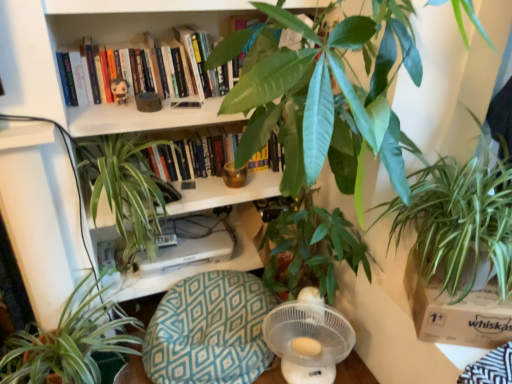
Question: Does white cardboard box at lower right have a larger size compared to plush toy at upper center?

Choices:
 (A) no
 (B) yes

Answer: (B)

Question: Is white cardboard box at lower right further to camera compared to plush toy at upper center?

Choices:
 (A) no
 (B) yes

Answer: (A)

Question: Is white cardboard box at lower right facing towards plush toy at upper center?

Choices:
 (A) no
 (B) yes

Answer: (A)

Question: Does white cardboard box at lower right have a lesser height compared to plush toy at upper center?

Choices:
 (A) no
 (B) yes

Answer: (A)

Question: Is white cardboard box at lower right oriented away from plush toy at upper center?

Choices:
 (A) no
 (B) yes

Answer: (A)

Question: From the image's perspective, would you say white cardboard box at lower right is shown under plush toy at upper center?

Choices:
 (A) no
 (B) yes

Answer: (B)

Question: Would you consider hardcover book at upper center to be distant from white plastic fan at lower center?

Choices:
 (A) yes
 (B) no

Answer: (A)

Question: Considering the relative sizes of hardcover book at upper center and white plastic fan at lower center in the image provided, is hardcover book at upper center wider than white plastic fan at lower center?

Choices:
 (A) yes
 (B) no

Answer: (B)

Question: Is hardcover book at upper center thinner than white plastic fan at lower center?

Choices:
 (A) yes
 (B) no

Answer: (A)

Question: Does hardcover book at upper center have a lesser height compared to white plastic fan at lower center?

Choices:
 (A) yes
 (B) no

Answer: (A)

Question: From the image's perspective, is hardcover book at upper center on white plastic fan at lower center?

Choices:
 (A) no
 (B) yes

Answer: (B)

Question: Can you confirm if hardcover book at upper center is bigger than white plastic fan at lower center?

Choices:
 (A) no
 (B) yes

Answer: (A)

Question: Is plush toy at upper center next to green leafy plant at lower left, acting as the fourth houseplant starting from the right?

Choices:
 (A) yes
 (B) no

Answer: (B)